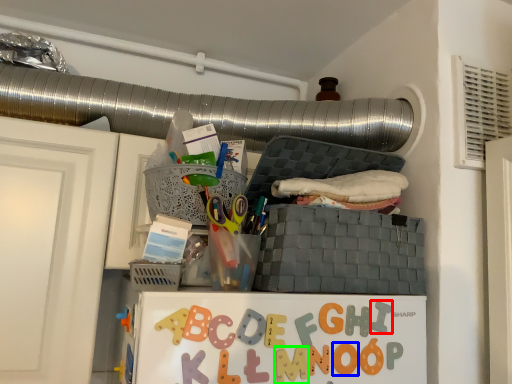
Question: Which is nearer to the alphabet (highlighted by a red box)? letter (highlighted by a blue box) or alphabet (highlighted by a green box).

Choices:
 (A) letter
 (B) alphabet

Answer: (A)